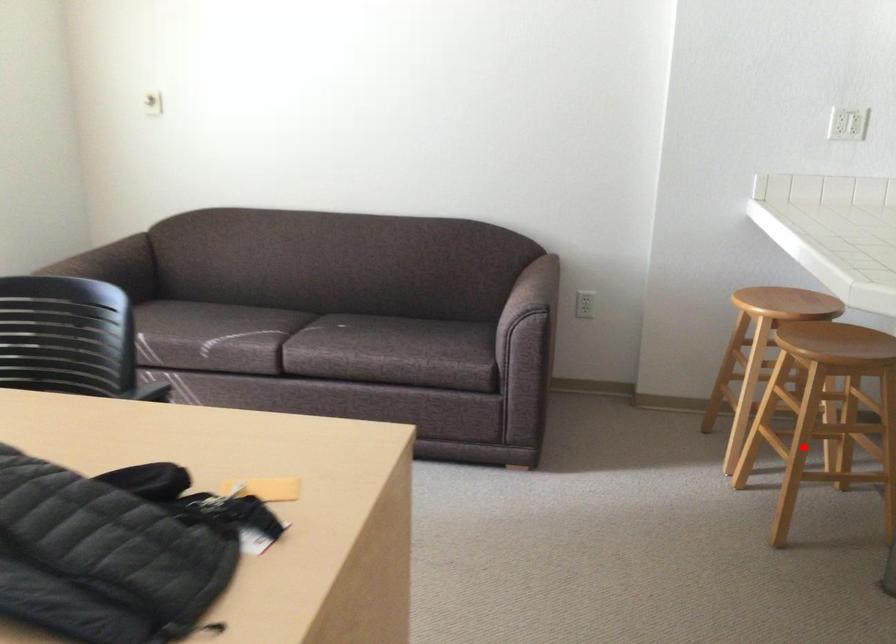
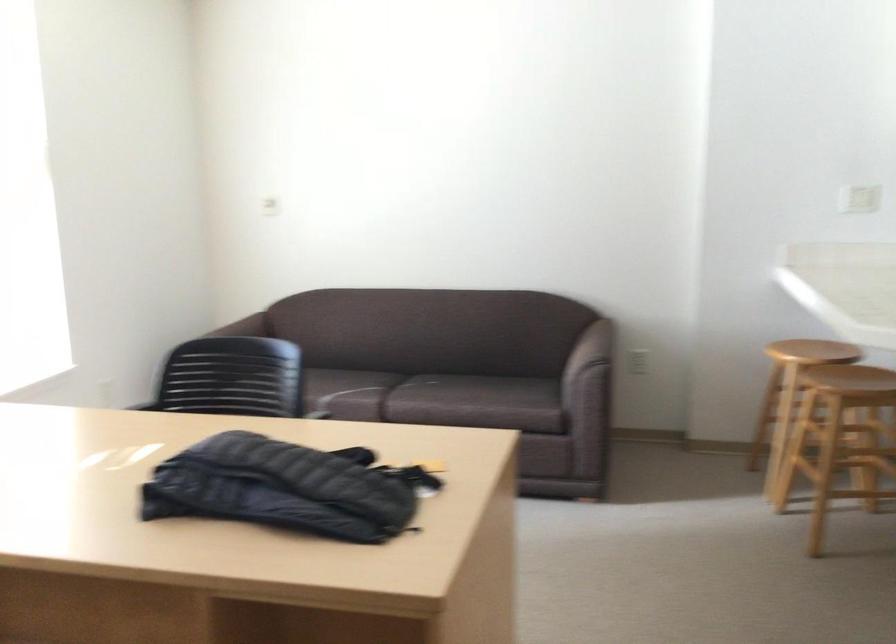
Locate, in the second image, the point that corresponds to the highlighted location in the first image.

(837, 466)